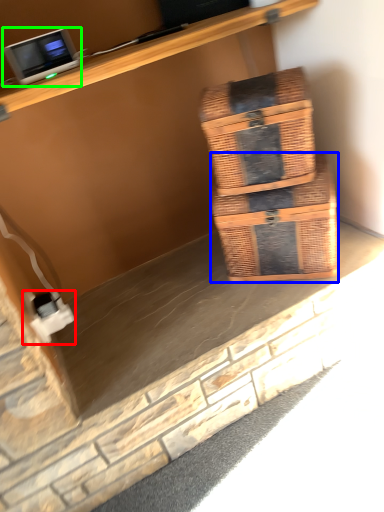
Question: Based on their relative distances, which object is nearer to electric outlet (highlighted by a red box)? Choose from box (highlighted by a blue box) and desktop computer (highlighted by a green box).

Choices:
 (A) box
 (B) desktop computer

Answer: (B)